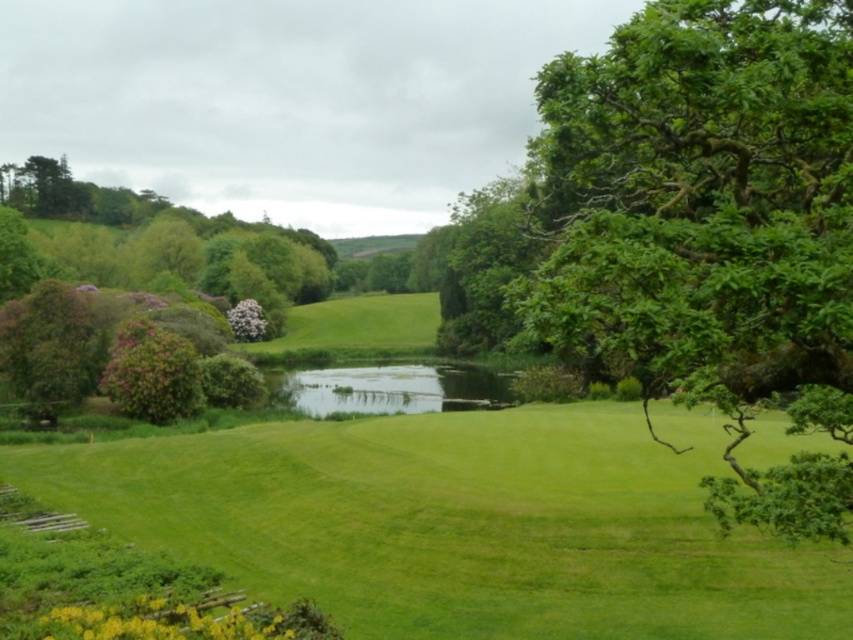
Which is more to the right, green leafy tree at center right or green grassy lake at center?

green leafy tree at center right is more to the right.

Between point (642, 52) and point (456, 401), which one is positioned behind?

Point (456, 401)

Measure the distance between point (746, 56) and camera.

6.85 meters

Where is `green leafy tree at center right`? This screenshot has width=853, height=640. green leafy tree at center right is located at coordinates (712, 228).